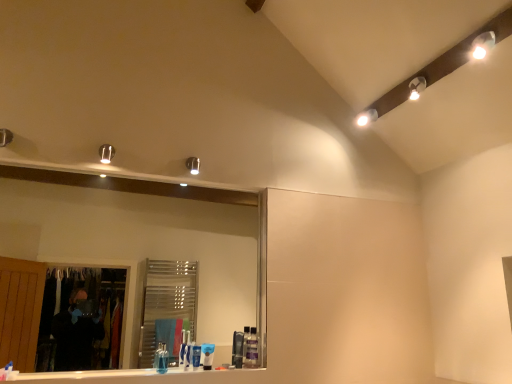
Find the location of a particular element. free point above clear glass mirror at center (from a real-world perspective) is located at coordinates coord(161,183).